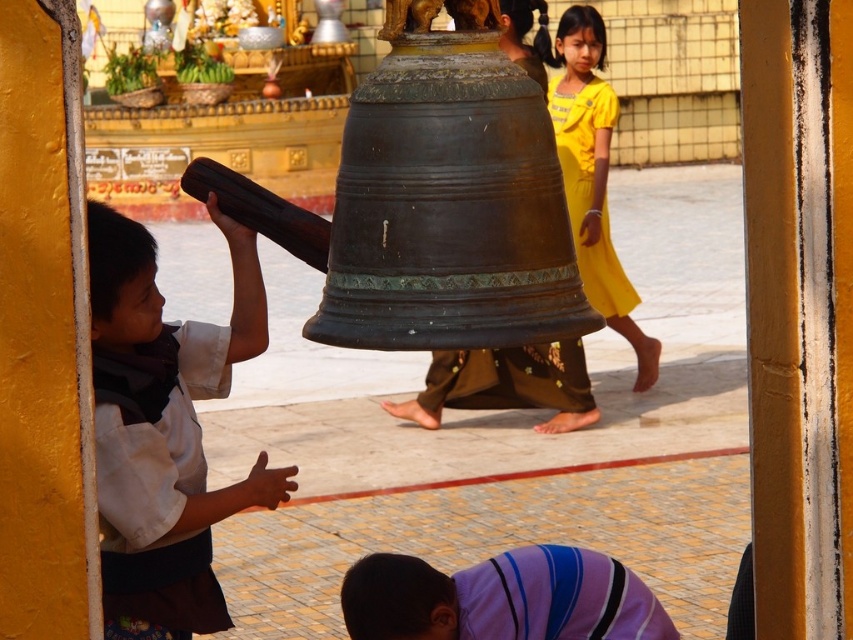
Question: Is white cotton robe at left closer to camera compared to bronze bell at center?

Choices:
 (A) yes
 (B) no

Answer: (A)

Question: Which of the following is the farthest from the observer?

Choices:
 (A) (128, 500)
 (B) (607, 141)

Answer: (B)

Question: Among these points, which one is farthest from the camera?

Choices:
 (A) (550, 544)
 (B) (103, 500)
 (C) (548, 97)

Answer: (C)

Question: In this image, where is white cotton shirt at left located relative to yellow matte dress at upper right?

Choices:
 (A) right
 (B) left

Answer: (B)

Question: Based on their relative distances, which object is farther from the white cotton robe at left?

Choices:
 (A) white cotton shirt at left
 (B) bronze bell at center

Answer: (B)

Question: Can you confirm if white cotton robe at left is thinner than yellow matte dress at upper right?

Choices:
 (A) no
 (B) yes

Answer: (B)